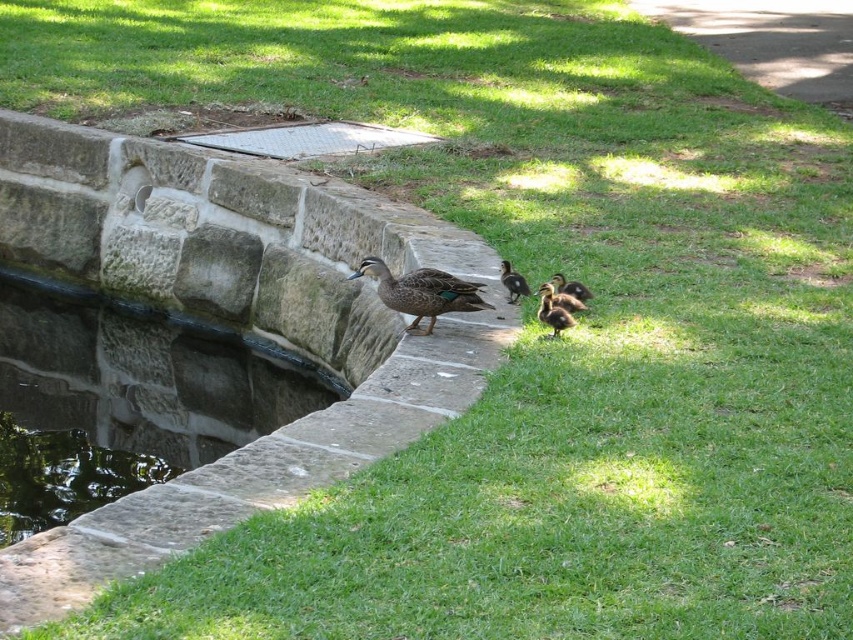
You are standing in the outdoor scene and want to place a small pebble at each of the two points labeled point (550, 298) and point (508, 269). Which point should you choose if you want the pebble to be closer to your current position?

You should choose point (550, 298) because it is closer to the camera than point (508, 269), so it will be closer to your current position.

You are a small dog exploring the grassy area near the water feature. You want to play with the ducklings but must stay at least 20 inches away to avoid disturbing them. Can you approach the brown fuzzy duckling at lower center if you are currently 18 inches away from the brown fuzzy duckling at center?

The brown fuzzy duckling at lower center and brown fuzzy duckling at center are 19.81 inches apart from each other. If you are 18 inches away from the brown fuzzy duckling at center, you would be 18 inches plus 19.81 inches away from the brown fuzzy duckling at lower center, totaling 37.81 inches. This distance exceeds the required 20 inches, so you can safely approach the brown fuzzy duckling at lower center without disturbing them.

You are a photographer trying to capture a photo of the brown speckled duck at center and the brown fuzzy duckling at lower center. The camera you are using has a minimum focus distance of 18 inches. Can you take a photo of both subjects without moving them?

The brown speckled duck at center and the brown fuzzy duckling at lower center are 20.07 inches apart. Since the minimum focus distance is 18 inches, the camera can focus on both subjects as they are within the required distance.